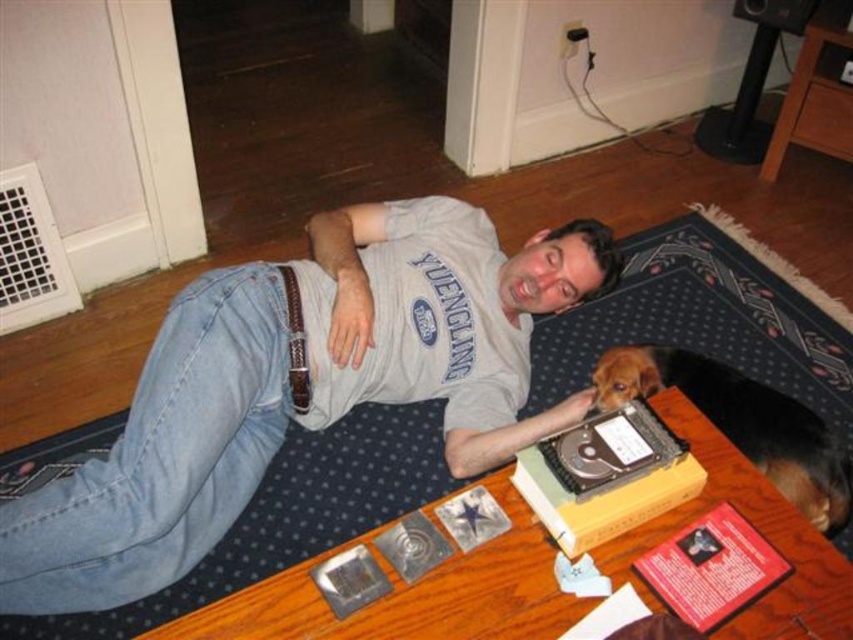
Question: Is gray cotton t-shirt at center to the left of brown furry dog at upper right from the viewer's perspective?

Choices:
 (A) no
 (B) yes

Answer: (B)

Question: Does gray cotton t-shirt at center appear over brown furry dog at upper right?

Choices:
 (A) no
 (B) yes

Answer: (B)

Question: Considering the relative positions of gray cotton t-shirt at center and brown furry dog at upper right in the image provided, where is gray cotton t-shirt at center located with respect to brown furry dog at upper right?

Choices:
 (A) left
 (B) right

Answer: (A)

Question: Which point is farther from the camera taking this photo?

Choices:
 (A) (403, 352)
 (B) (796, 429)

Answer: (A)